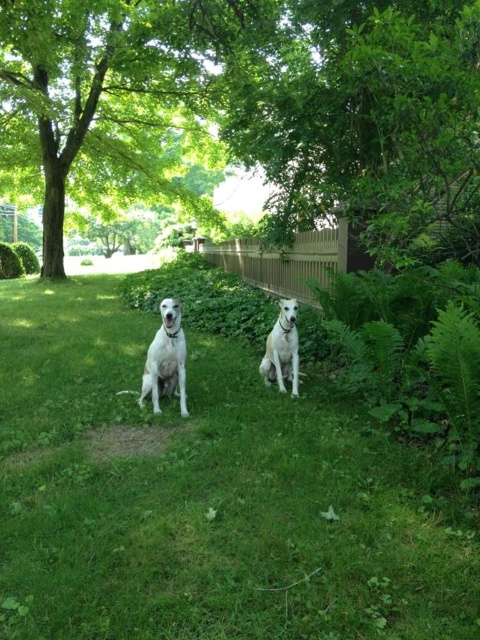
Question: Can you confirm if green grass at center is wider than white fur dog at center?

Choices:
 (A) yes
 (B) no

Answer: (A)

Question: Which object is positioned farthest from the white glossy dog at center?

Choices:
 (A) white fur dog at center
 (B) green grass at center
 (C) green leafy tree at center

Answer: (C)

Question: Can you confirm if green leafy tree at center is thinner than white fur dog at center?

Choices:
 (A) yes
 (B) no

Answer: (B)

Question: Which point is farther from the camera taking this photo?

Choices:
 (A) (204, 506)
 (B) (294, 372)

Answer: (B)

Question: Does green leafy tree at center have a larger size compared to white glossy dog at center?

Choices:
 (A) yes
 (B) no

Answer: (A)

Question: Which point is farther to the camera?

Choices:
 (A) (171, 316)
 (B) (287, 369)
 (C) (255, 392)

Answer: (B)